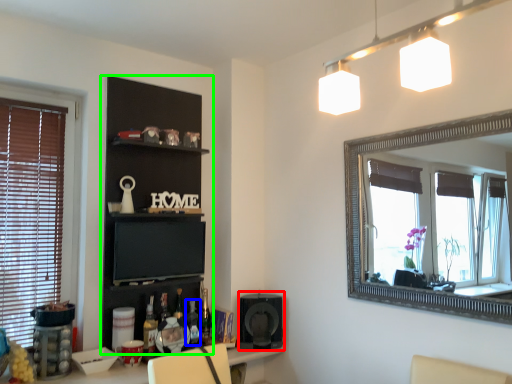
Question: Which object is the farthest from speaker (highlighted by a red box)? Choose among these: bottle (highlighted by a blue box) or shelf (highlighted by a green box).

Choices:
 (A) bottle
 (B) shelf

Answer: (B)